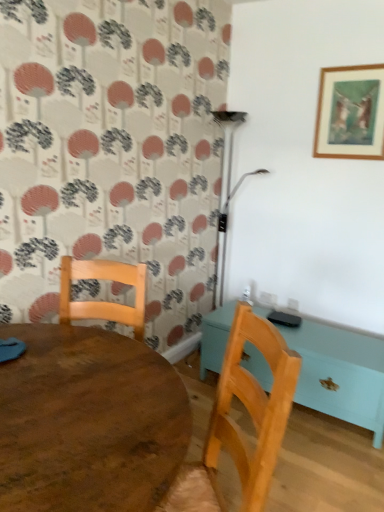
Where is `wooden picture frame at upper right`? This screenshot has width=384, height=512. wooden picture frame at upper right is located at coordinates coord(350,113).

Find the location of a particular element. The width and height of the screenshot is (384, 512). wooden table at center, which is the second table in right-to-left order is located at coordinates click(x=88, y=422).

Identify the location of wooden chair at lower center. The image size is (384, 512). (237, 425).

From the image's perspective, is wooden table at center, marked as the second table in a front-to-back arrangement, located above metallic silver lamp at upper right?

No, from the image's perspective, wooden table at center, marked as the second table in a front-to-back arrangement, is not on top of metallic silver lamp at upper right.

Which object is positioned more to the left, wooden table at center, the 1th table from the back, or metallic silver lamp at upper right?

From the viewer's perspective, metallic silver lamp at upper right appears more on the left side.

Is wooden table at center, marked as the second table in a front-to-back arrangement, directly adjacent to metallic silver lamp at upper right?

They are not placed beside each other.

Who is taller, wooden table at center, the 1th table from the back, or metallic silver lamp at upper right?

metallic silver lamp at upper right is taller.

Image resolution: width=384 pixels, height=512 pixels. Find the location of `chair that is above the wooden table at center, the 1th table in the front-to-back sequence (from the image's perspective)`. chair that is above the wooden table at center, the 1th table in the front-to-back sequence (from the image's perspective) is located at coordinates (237, 425).

Are wooden table at center, the 1th table in the front-to-back sequence, and wooden chair at lower center making contact?

wooden table at center, the 1th table in the front-to-back sequence, is not next to wooden chair at lower center, and they're not touching.

Considering the relative sizes of wooden table at center, the 1th table positioned from the left, and wooden chair at lower center in the image provided, is wooden table at center, the 1th table positioned from the left, bigger than wooden chair at lower center?

Yes, wooden table at center, the 1th table positioned from the left, is bigger than wooden chair at lower center.

Is wooden table at center, the 1th table in the front-to-back sequence, shorter than wooden chair at lower center?

Yes.

Is point (206, 452) less distant than point (331, 365)?

Yes, it is.

Is wooden chair at lower center not within wooden table at center, marked as the second table in a front-to-back arrangement?

Yes, wooden chair at lower center is outside of wooden table at center, marked as the second table in a front-to-back arrangement.

Which object is positioned more to the right, wooden chair at lower center or wooden table at center, marked as the second table in a front-to-back arrangement?

wooden table at center, marked as the second table in a front-to-back arrangement, is more to the right.

Is the position of wooden chair at lower center more distant than that of wooden table at center, the 2th table from the left?

No.

Which object is thinner, wooden table at center, the 2th table from the left, or wooden picture frame at upper right?

wooden picture frame at upper right.

Does wooden table at center, the 2th table from the left, have a lesser height compared to wooden picture frame at upper right?

Correct, wooden table at center, the 2th table from the left, is not as tall as wooden picture frame at upper right.

From a real-world perspective, is wooden table at center, the 2th table from the left, located higher than wooden picture frame at upper right?

No, from a real-world perspective, wooden table at center, the 2th table from the left, is not above wooden picture frame at upper right.

Locate an element on the screen. Image resolution: width=384 pixels, height=512 pixels. lamp on the left of wooden table at center, marked as the second table in a front-to-back arrangement is located at coordinates (227, 196).

Considering the positions of objects metallic silver lamp at upper right and wooden table at center, the 1th table from the back, in the image provided, who is more to the right, metallic silver lamp at upper right or wooden table at center, the 1th table from the back,?

From the viewer's perspective, wooden table at center, the 1th table from the back, appears more on the right side.

Is point (223, 263) closer or farther from the camera than point (307, 398)?

Point (223, 263) is farther from the camera than point (307, 398).

Considering the relative positions of metallic silver lamp at upper right and wooden table at center, the 1th table from the right, in the image provided, is metallic silver lamp at upper right behind wooden table at center, the 1th table from the right,?

That is True.

The height and width of the screenshot is (512, 384). What are the coordinates of `picture frame behind the wooden table at center, which is the 2th table from back to front` in the screenshot? It's located at (350, 113).

Choose the correct answer: Is wooden picture frame at upper right inside wooden table at center, the 1th table in the front-to-back sequence, or outside it?

wooden picture frame at upper right is not enclosed by wooden table at center, the 1th table in the front-to-back sequence.

How much distance is there between wooden picture frame at upper right and wooden table at center, the 1th table in the front-to-back sequence?

A distance of 2.07 meters exists between wooden picture frame at upper right and wooden table at center, the 1th table in the front-to-back sequence.

Consider the image. From the image's perspective, relative to wooden picture frame at upper right, is wooden chair at lower center above or below?

wooden chair at lower center is situated lower than wooden picture frame at upper right in the image.

In order to click on picture frame on the right of wooden chair at lower center in this screenshot , I will do `click(350, 113)`.

Is the surface of wooden chair at lower center in direct contact with wooden picture frame at upper right?

wooden chair at lower center and wooden picture frame at upper right are not in contact.

From a real-world perspective, which is physically above, wooden chair at lower center or wooden picture frame at upper right?

In real-world perspective, wooden picture frame at upper right is above.

You are a GUI agent. You are given a task and a screenshot of the screen. Output one action in this format:
    pyautogui.click(x=<x>, y=<y>)
    Task: Click on the lamp that appears on the left of wooden table at center, the 2th table from the left
    
    Given the screenshot: What is the action you would take?
    pyautogui.click(x=227, y=196)

This screenshot has height=512, width=384. I want to click on chair above the wooden table at center, the 1th table positioned from the left (from a real-world perspective), so click(x=237, y=425).

When comparing their distances from wooden picture frame at upper right, does metallic silver lamp at upper right or wooden table at center, the 2th table from the left, seem further?

wooden table at center, the 2th table from the left, is positioned further to the anchor wooden picture frame at upper right.

Based on their spatial positions, is wooden picture frame at upper right or metallic silver lamp at upper right further from wooden table at center, the 1th table from the back?

wooden picture frame at upper right is further to wooden table at center, the 1th table from the back.

Which object lies nearer to the anchor point wooden table at center, which is the 2th table from back to front, wooden table at center, the 1th table from the right, or metallic silver lamp at upper right?

wooden table at center, the 1th table from the right, is positioned closer to the anchor wooden table at center, which is the 2th table from back to front.

Based on their spatial positions, is wooden picture frame at upper right or wooden table at center, the 1th table positioned from the left, further from wooden chair at lower center?

Among the two, wooden picture frame at upper right is located further to wooden chair at lower center.

When comparing their distances from wooden table at center, which is the 2th table from back to front, does metallic silver lamp at upper right or wooden table at center, the 1th table from the right, seem further?

metallic silver lamp at upper right lies further to wooden table at center, which is the 2th table from back to front, than the other object.

Considering their positions, is wooden chair at lower center positioned closer to wooden table at center, the 2th table from the left, than wooden table at center, which is the 2th table from back to front?

wooden chair at lower center.

When comparing their distances from wooden picture frame at upper right, does wooden chair at lower center or wooden table at center, the 2th table from the left, seem further?

The object further to wooden picture frame at upper right is wooden chair at lower center.

Which object lies nearer to the anchor point wooden chair at lower center, metallic silver lamp at upper right or wooden table at center, marked as the second table in a front-to-back arrangement?

Among the two, wooden table at center, marked as the second table in a front-to-back arrangement, is located nearer to wooden chair at lower center.

I want to click on picture frame between wooden table at center, the 1th table in the front-to-back sequence, and metallic silver lamp at upper right in the front-back direction, so click(350, 113).

Identify the location of table that lies between wooden picture frame at upper right and wooden table at center, the 1th table positioned from the left, from top to bottom. The width and height of the screenshot is (384, 512). coord(340,373).

The width and height of the screenshot is (384, 512). Find the location of `chair positioned between wooden table at center, which is the 2th table from back to front, and metallic silver lamp at upper right from near to far`. chair positioned between wooden table at center, which is the 2th table from back to front, and metallic silver lamp at upper right from near to far is located at coordinates (237, 425).

Locate an element on the screen. This screenshot has width=384, height=512. chair between wooden table at center, the 1th table in the front-to-back sequence, and wooden table at center, the 1th table from the back, from front to back is located at coordinates (237, 425).